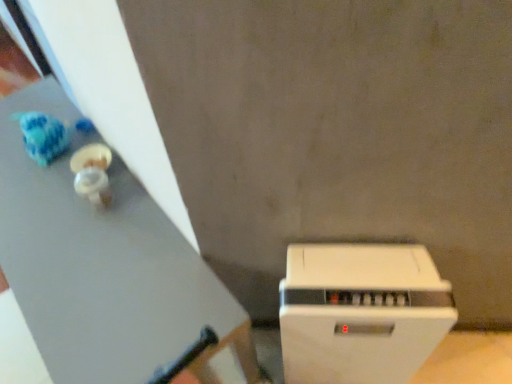
This screenshot has width=512, height=384. Find the location of `white matte table at upper left`. white matte table at upper left is located at coordinates (102, 265).

The width and height of the screenshot is (512, 384). What do you see at coordinates (102, 265) in the screenshot?
I see `white matte table at upper left` at bounding box center [102, 265].

The width and height of the screenshot is (512, 384). What do you see at coordinates (361, 313) in the screenshot?
I see `white plastic toaster at lower right` at bounding box center [361, 313].

Where is `white plastic toaster at lower right`? white plastic toaster at lower right is located at coordinates (361, 313).

The height and width of the screenshot is (384, 512). Find the location of `white matte table at upper left`. white matte table at upper left is located at coordinates [x=102, y=265].

In the scene shown: Considering the positions of objects white plastic toaster at lower right and white matte table at upper left in the image provided, who is more to the left, white plastic toaster at lower right or white matte table at upper left?

From the viewer's perspective, white matte table at upper left appears more on the left side.

Is white plastic toaster at lower right further to the viewer compared to white matte table at upper left?

No, it is not.

Is point (300, 360) less distant than point (29, 283)?

That is False.

From the image's perspective, which one is positioned lower, white plastic toaster at lower right or white matte table at upper left?

white plastic toaster at lower right, from the image's perspective.

From a real-world perspective, which object stands above the other?

white plastic toaster at lower right is physically above.

Does white plastic toaster at lower right have a greater width compared to white matte table at upper left?

In fact, white plastic toaster at lower right might be narrower than white matte table at upper left.

Which of these two, white plastic toaster at lower right or white matte table at upper left, stands shorter?

white matte table at upper left.

Considering the relative sizes of white plastic toaster at lower right and white matte table at upper left in the image provided, is white plastic toaster at lower right smaller than white matte table at upper left?

Yes, white plastic toaster at lower right is smaller than white matte table at upper left.

Is white plastic toaster at lower right situated inside white matte table at upper left or outside?

white plastic toaster at lower right lies outside white matte table at upper left.

Is white plastic toaster at lower right not close to white matte table at upper left?

They are positioned close to each other.

Is white plastic toaster at lower right oriented away from white matte table at upper left?

That's not correct — white plastic toaster at lower right is not looking away from white matte table at upper left.

Can you tell me how much white plastic toaster at lower right and white matte table at upper left differ in facing direction?

The angle between the facing direction of white plastic toaster at lower right and the facing direction of white matte table at upper left is 48.5 degrees.

How far apart are white plastic toaster at lower right and white matte table at upper left?

white plastic toaster at lower right and white matte table at upper left are 14.69 inches apart.

In the image, there is a white matte table at upper left. What are the coordinates of `home appliance below it (from the image's perspective)` in the screenshot? It's located at (361, 313).

Which object is positioned more to the right, white matte table at upper left or white plastic toaster at lower right?

white plastic toaster at lower right.

Relative to white plastic toaster at lower right, is white matte table at upper left in front or behind?

white matte table at upper left is behind white plastic toaster at lower right.

Is point (80, 373) closer to viewer compared to point (336, 301)?

No, (80, 373) is behind (336, 301).

From the image's perspective, who appears lower, white matte table at upper left or white plastic toaster at lower right?

white plastic toaster at lower right, from the image's perspective.

From a real-world perspective, between white matte table at upper left and white plastic toaster at lower right, who is vertically higher?

white plastic toaster at lower right is physically above.

Which object is wider, white matte table at upper left or white plastic toaster at lower right?

Wider between the two is white matte table at upper left.

Between white matte table at upper left and white plastic toaster at lower right, which one has more height?

Standing taller between the two is white plastic toaster at lower right.

Considering the relative sizes of white matte table at upper left and white plastic toaster at lower right in the image provided, is white matte table at upper left smaller than white plastic toaster at lower right?

No, white matte table at upper left is not smaller than white plastic toaster at lower right.

Does white matte table at upper left contain white plastic toaster at lower right?

No, white matte table at upper left does not contain white plastic toaster at lower right.

Would you say white matte table at upper left is a long distance from white plastic toaster at lower right?

No, white matte table at upper left is not far from white plastic toaster at lower right.

Is white matte table at upper left facing away from white plastic toaster at lower right?

No, white matte table at upper left is not facing away from white plastic toaster at lower right.

Locate an element on the screen. The height and width of the screenshot is (384, 512). table on the left of white plastic toaster at lower right is located at coordinates (102, 265).

Find the location of a particular element. table behind the white plastic toaster at lower right is located at coordinates (102, 265).

The height and width of the screenshot is (384, 512). In order to click on home appliance above the white matte table at upper left (from a real-world perspective) in this screenshot , I will do `click(361, 313)`.